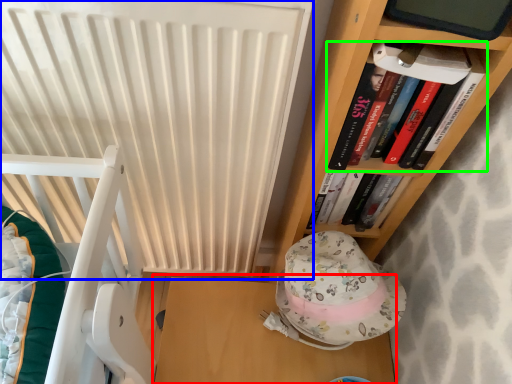
Question: Which object is the farthest from table (highlighted by a red box)? Choose among these: radiator (highlighted by a blue box) or book (highlighted by a green box).

Choices:
 (A) radiator
 (B) book

Answer: (B)